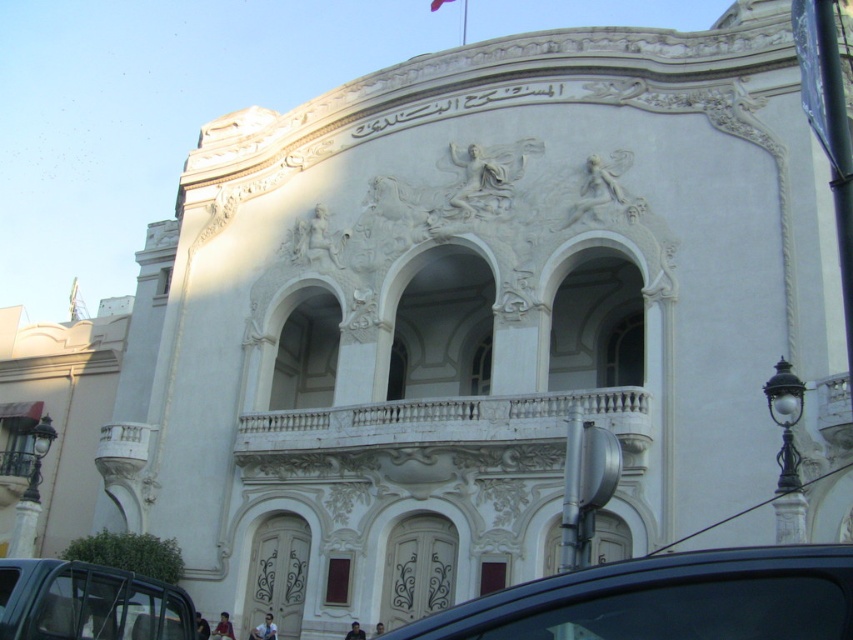
Does black glossy car at lower center have a lesser height compared to white fabric flag at upper center?

No.

From the picture: Can you confirm if black glossy car at lower center is wider than white fabric flag at upper center?

Indeed, black glossy car at lower center has a greater width compared to white fabric flag at upper center.

Measure the distance between point (775, 621) and camera.

A distance of 55.82 feet exists between point (775, 621) and camera.

Where is `black glossy car at lower center`? This screenshot has height=640, width=853. black glossy car at lower center is located at coordinates (666, 600).

Is point (102, 604) positioned behind point (438, 3)?

No.

This screenshot has height=640, width=853. Find the location of `metallic gray car at lower left`. metallic gray car at lower left is located at coordinates tap(88, 602).

This screenshot has width=853, height=640. I want to click on metallic gray car at lower left, so click(x=88, y=602).

You are a GUI agent. You are given a task and a screenshot of the screen. Output one action in this format:
    pyautogui.click(x=<x>, y=<y>)
    Task: Click on the metallic gray car at lower left
    Image resolution: width=853 pixels, height=640 pixels.
    Given the screenshot: What is the action you would take?
    pyautogui.click(x=88, y=602)

Is the position of black glossy car at lower center more distant than that of metallic gray car at lower left?

No, black glossy car at lower center is in front of metallic gray car at lower left.

Is black glossy car at lower center bigger than metallic gray car at lower left?

Indeed, black glossy car at lower center has a larger size compared to metallic gray car at lower left.

Is point (618, 563) farther from camera compared to point (184, 593)?

Yes, it is behind point (184, 593).

Locate an element on the screen. Image resolution: width=853 pixels, height=640 pixels. black glossy car at lower center is located at coordinates 666,600.